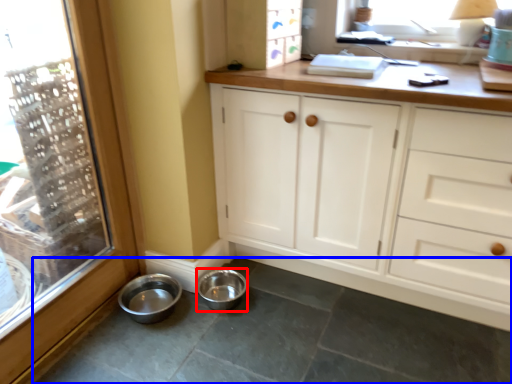
Question: Which point is further to the camera, basin (highlighted by a red box) or concrete (highlighted by a blue box)?

Choices:
 (A) basin
 (B) concrete

Answer: (A)